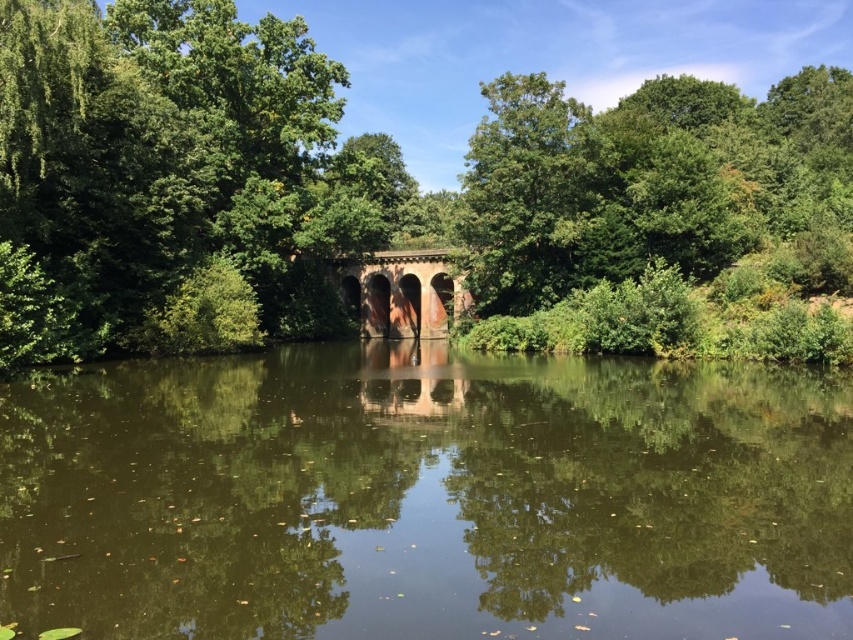
Question: Among these objects, which one is nearest to the camera?

Choices:
 (A) rustic stone bridge at center
 (B) green reflective water at center

Answer: (B)

Question: Which is farther from the green reflective water at center?

Choices:
 (A) green leafy tree at center
 (B) rustic stone bridge at center

Answer: (B)

Question: Is green leafy tree at center to the right of rustic stone bridge at center from the viewer's perspective?

Choices:
 (A) no
 (B) yes

Answer: (B)

Question: Is green leafy tree at center bigger than rustic stone bridge at center?

Choices:
 (A) no
 (B) yes

Answer: (B)

Question: Based on their relative distances, which object is farther from the green reflective water at center?

Choices:
 (A) green leafy tree at center
 (B) rustic stone bridge at center

Answer: (B)

Question: Is green leafy tree at center bigger than rustic stone bridge at center?

Choices:
 (A) no
 (B) yes

Answer: (B)